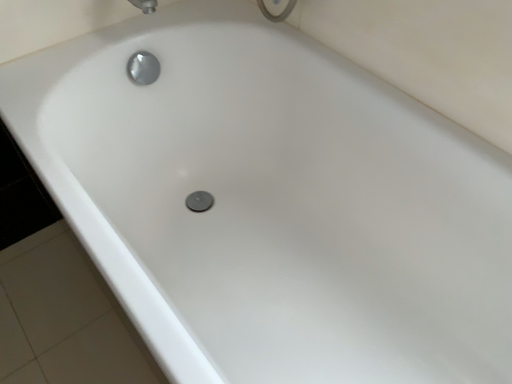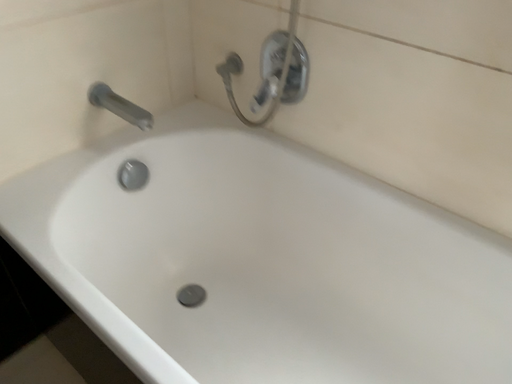
Question: Which way did the camera rotate in the video?

Choices:
 (A) rotated left
 (B) rotated right

Answer: (B)